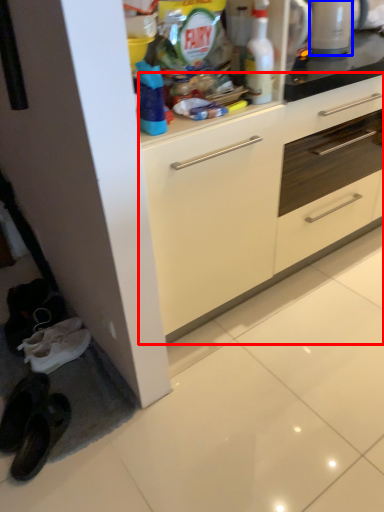
Question: Among these objects, which one is nearest to the camera, cabinetry (highlighted by a red box) or appliance (highlighted by a blue box)?

Choices:
 (A) cabinetry
 (B) appliance

Answer: (A)